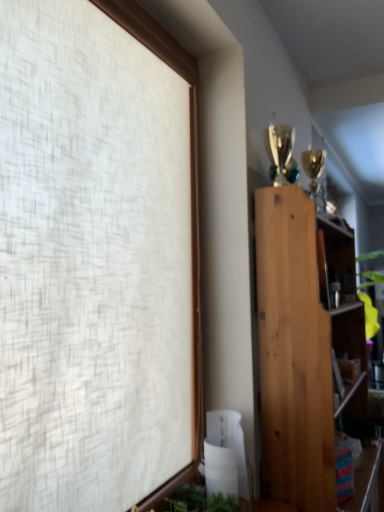
Question: Based on their sizes in the image, would you say green leafy plant at bottom is bigger or smaller than natural wood bookcase at right?

Choices:
 (A) small
 (B) big

Answer: (A)

Question: Would you say green leafy plant at bottom is inside or outside natural wood bookcase at right?

Choices:
 (A) outside
 (B) inside

Answer: (A)

Question: Considering the positions of point (170, 501) and point (327, 418), is point (170, 501) closer or farther from the camera than point (327, 418)?

Choices:
 (A) farther
 (B) closer

Answer: (B)

Question: Is natural wood bookcase at right in front of or behind green leafy plant at bottom in the image?

Choices:
 (A) behind
 (B) front

Answer: (A)

Question: Is natural wood bookcase at right situated inside green leafy plant at bottom or outside?

Choices:
 (A) inside
 (B) outside

Answer: (B)

Question: Is natural wood bookcase at right to the left or to the right of green leafy plant at bottom in the image?

Choices:
 (A) left
 (B) right

Answer: (B)

Question: Considering the positions of natural wood bookcase at right and green leafy plant at bottom in the image, is natural wood bookcase at right bigger or smaller than green leafy plant at bottom?

Choices:
 (A) big
 (B) small

Answer: (A)